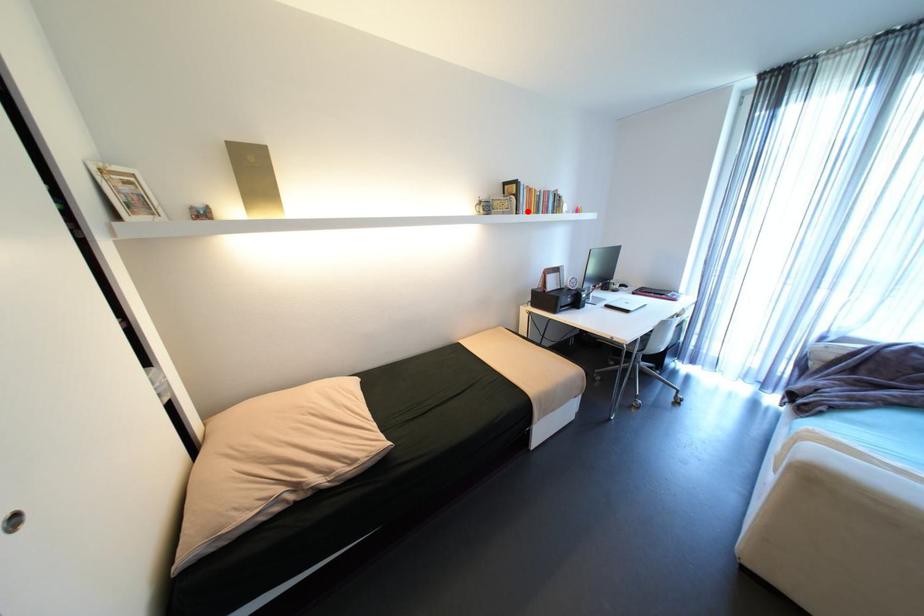
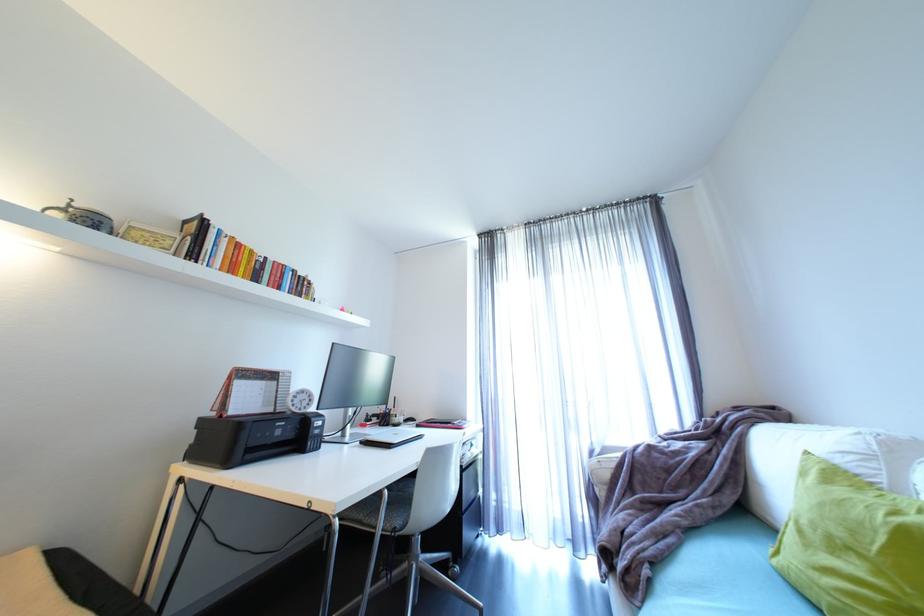
Find the pixel in the second image that matches the highlighted location in the first image.

(208, 262)